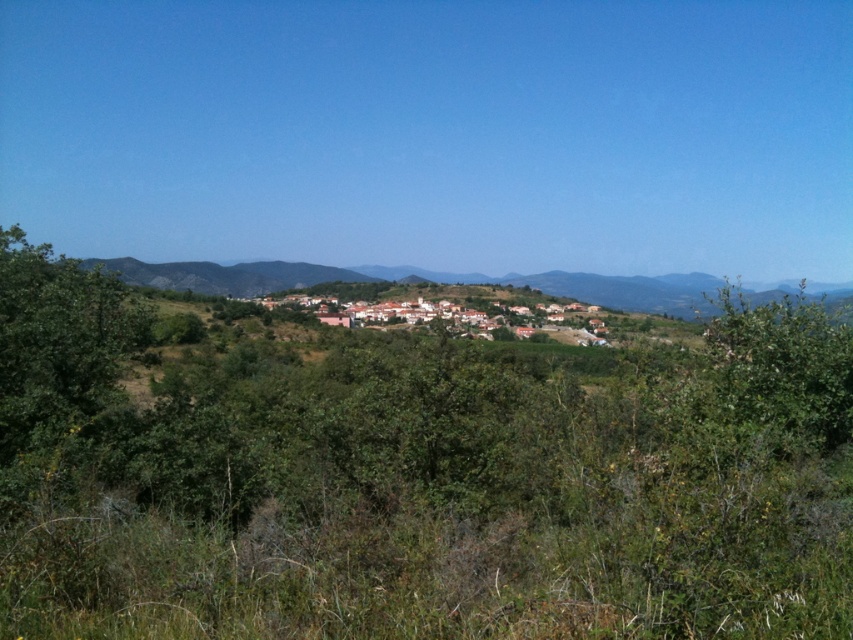
Question: Which object is closer to the camera taking this photo?

Choices:
 (A) green leafy bush at upper right
 (B) green leafy tree at left

Answer: (A)

Question: Is green leafy tree at left to the right of green leafy bush at upper right from the viewer's perspective?

Choices:
 (A) yes
 (B) no

Answer: (B)

Question: Where is green leafy tree at left located in relation to green leafy bush at upper right in the image?

Choices:
 (A) above
 (B) below

Answer: (A)

Question: Which point is closer to the camera taking this photo?

Choices:
 (A) (796, 348)
 (B) (111, 339)

Answer: (A)

Question: In this image, where is green leafy tree at left located relative to green leafy bush at upper right?

Choices:
 (A) above
 (B) below

Answer: (A)